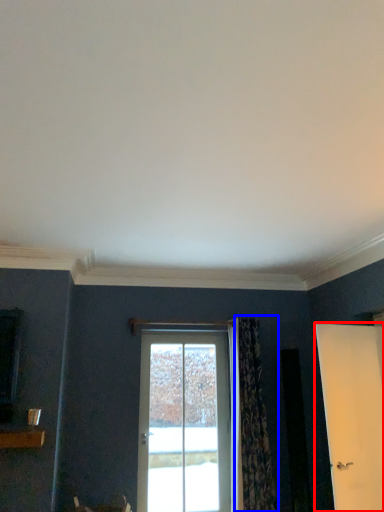
Question: Which point is closer to the camera, door (highlighted by a red box) or curtain (highlighted by a blue box)?

Choices:
 (A) door
 (B) curtain

Answer: (A)